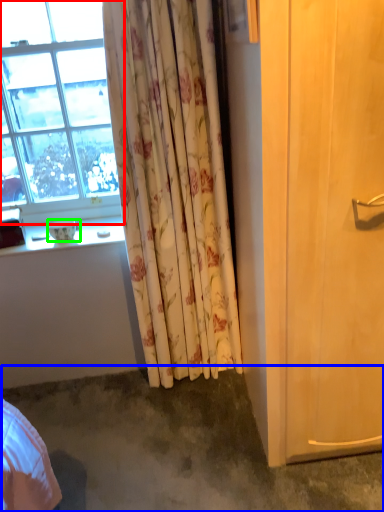
Question: Estimate the real-world distances between objects in this image. Which object is farther from window (highlighted by a red box), concrete (highlighted by a blue box) or bowl (highlighted by a green box)?

Choices:
 (A) concrete
 (B) bowl

Answer: (A)